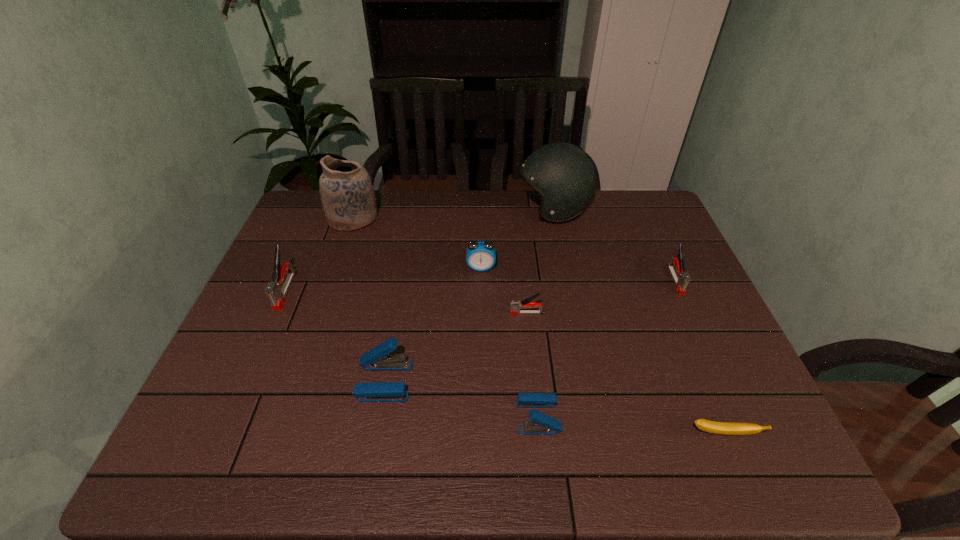
Locate an element on the screen. the smallest gray stapler is located at coordinates (516, 305).

Where is `the smaller blue stapler`? the smaller blue stapler is located at coordinates (541, 424).

Find the location of a particular element. banana is located at coordinates (728, 428).

I want to click on yellow banana, so click(728, 428).

Where is `vacant space situated 0.280m at the face opening of the green football helmet`? The width and height of the screenshot is (960, 540). vacant space situated 0.280m at the face opening of the green football helmet is located at coordinates (x=435, y=210).

Find the location of a particular element. free space located 0.070m at the face opening of the green football helmet is located at coordinates (496, 210).

Where is `free spot located at the face opening of the green football helmet`? Image resolution: width=960 pixels, height=540 pixels. free spot located at the face opening of the green football helmet is located at coordinates (455, 210).

This screenshot has height=540, width=960. Find the location of `free space located on the front of the eighth object from right to left`. free space located on the front of the eighth object from right to left is located at coordinates (343, 247).

This screenshot has height=540, width=960. Find the location of `free location located 0.180m on the handle side of the leftmost object`. free location located 0.180m on the handle side of the leftmost object is located at coordinates (252, 368).

Find the location of a particular element. The width and height of the screenshot is (960, 540). vacant space positioned 0.340m on the handle side of the second smallest gray stapler is located at coordinates (732, 407).